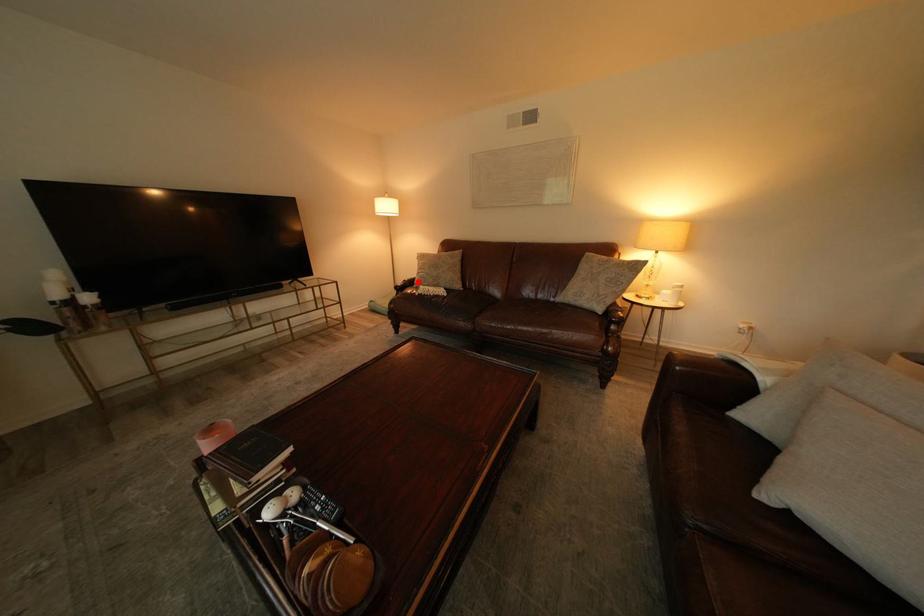
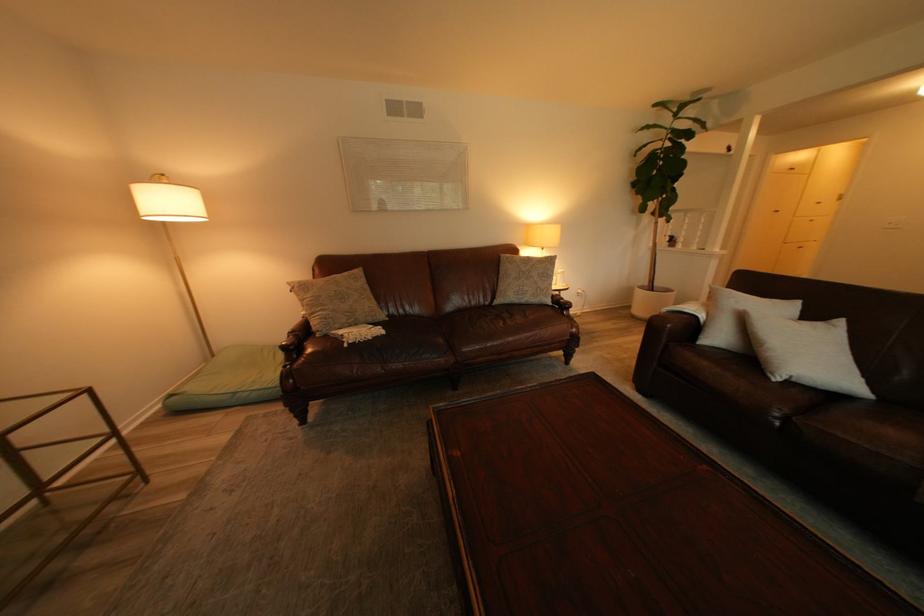
Where in the second image is the point corresponding to the highlighted location from the first image?

(304, 334)